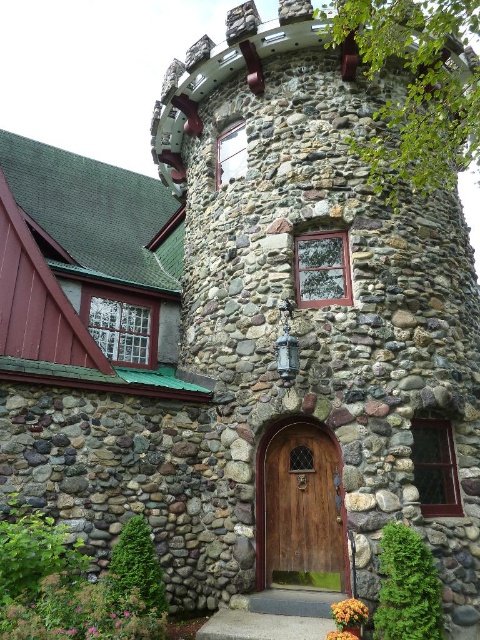
Measure the distance between point (285, 572) and camera.

Point (285, 572) and camera are 9.76 meters apart.

Image resolution: width=480 pixels, height=640 pixels. What do you see at coordinates (300, 508) in the screenshot? I see `wooden door at center` at bounding box center [300, 508].

Is point (298, 579) positioned before point (355, 612)?

No, (298, 579) is behind (355, 612).

Where is `wooden door at center`? The width and height of the screenshot is (480, 640). wooden door at center is located at coordinates point(300,508).

Is pink soft-textured flowers at lower left to the left of orange matte flower at lower right from the viewer's perspective?

Correct, you'll find pink soft-textured flowers at lower left to the left of orange matte flower at lower right.

Is pink soft-textured flowers at lower left shorter than orange matte flower at lower right?

In fact, pink soft-textured flowers at lower left may be taller than orange matte flower at lower right.

Where is `pink soft-textured flowers at lower left`? Image resolution: width=480 pixels, height=640 pixels. pink soft-textured flowers at lower left is located at coordinates (81, 612).

Who is higher up, wooden door at center or orange matte flower at lower center?

wooden door at center is higher up.

In the scene shown: Is wooden door at center smaller than orange matte flower at lower center?

Actually, wooden door at center might be larger than orange matte flower at lower center.

This screenshot has width=480, height=640. Describe the element at coordinates (300, 508) in the screenshot. I see `wooden door at center` at that location.

The width and height of the screenshot is (480, 640). What are the coordinates of `wooden door at center` in the screenshot? It's located at (300, 508).